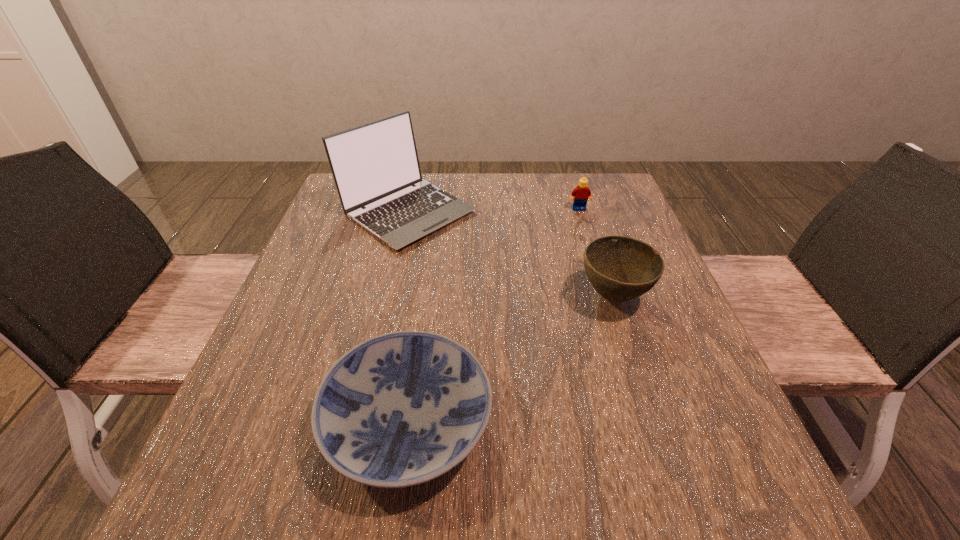
Where is `vacant area that satisfies the following two spatial constraints: 1. on the front-facing side of the Lego; 2. on the right side of the bowl`? vacant area that satisfies the following two spatial constraints: 1. on the front-facing side of the Lego; 2. on the right side of the bowl is located at coordinates (607, 296).

Find the location of a particular element. This screenshot has height=540, width=960. vacant space that satisfies the following two spatial constraints: 1. at the front screen of the laptop_computer; 2. on the left side of the bowl is located at coordinates (388, 296).

The image size is (960, 540). I want to click on vacant space that satisfies the following two spatial constraints: 1. at the front screen of the shortest object; 2. on the right side of the tallest object, so click(x=360, y=422).

In order to click on free space in the image that satisfies the following two spatial constraints: 1. on the front-facing side of the bowl; 2. on the left side of the Lego in this screenshot , I will do pos(607,296).